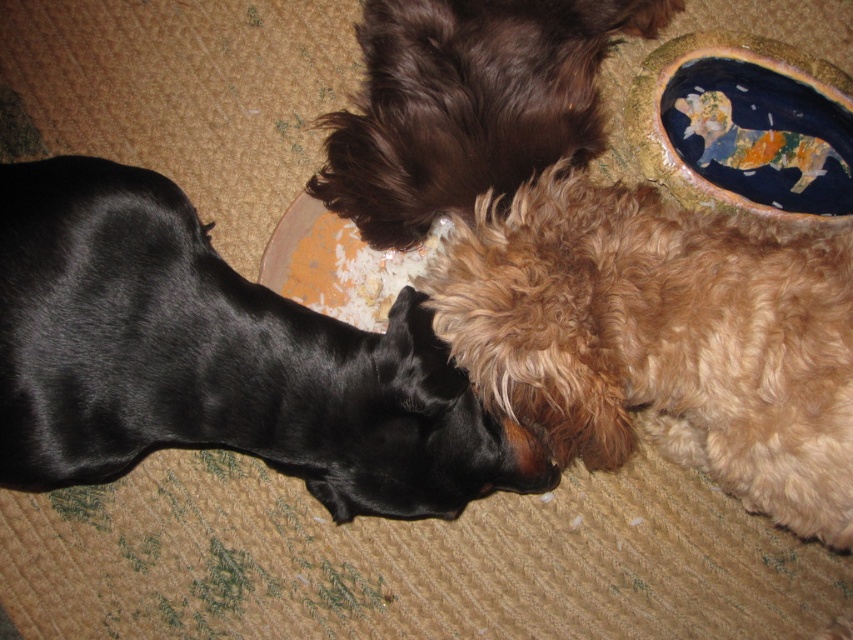
Does fuzzy brown dog at center have a smaller size compared to brown fluffy dog at upper center?

Yes, fuzzy brown dog at center is smaller than brown fluffy dog at upper center.

What do you see at coordinates (662, 337) in the screenshot?
I see `fuzzy brown dog at center` at bounding box center [662, 337].

In order to click on fuzzy brown dog at center in this screenshot , I will do `click(662, 337)`.

Does black shiny fur dog at lower left appear over fuzzy brown dog at center?

Incorrect, black shiny fur dog at lower left is not positioned above fuzzy brown dog at center.

Can you confirm if black shiny fur dog at lower left is positioned to the left of fuzzy brown dog at center?

Indeed, black shiny fur dog at lower left is positioned on the left side of fuzzy brown dog at center.

Measure the distance between point (169, 444) and camera.

The distance of point (169, 444) from camera is 1.61 meters.

Where is `black shiny fur dog at lower left`? This screenshot has width=853, height=640. black shiny fur dog at lower left is located at coordinates (218, 360).

Can you confirm if black shiny fur dog at lower left is positioned above brown fluffy dog at upper center?

No.

Can you confirm if black shiny fur dog at lower left is positioned to the left of brown fluffy dog at upper center?

Yes, black shiny fur dog at lower left is to the left of brown fluffy dog at upper center.

This screenshot has height=640, width=853. What are the coordinates of `black shiny fur dog at lower left` in the screenshot? It's located at (218, 360).